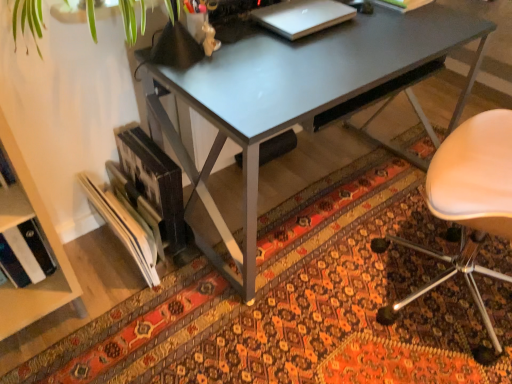
The image size is (512, 384). Describe the element at coordinates (402, 4) in the screenshot. I see `hardcover book at upper center` at that location.

Describe the element at coordinates (467, 208) in the screenshot. I see `beige leather chair at right` at that location.

Image resolution: width=512 pixels, height=384 pixels. Identify the location of sleek silver laptop at upper center. (302, 17).

The image size is (512, 384). What do you see at coordinates (301, 304) in the screenshot? I see `patterned carpet at lower center` at bounding box center [301, 304].

Where is `patterned carpet at lower center`? The width and height of the screenshot is (512, 384). patterned carpet at lower center is located at coordinates (301, 304).

Where is `metallic gray desk at center`? This screenshot has width=512, height=384. metallic gray desk at center is located at coordinates (295, 95).

Identify the location of laptop above the beige leather chair at right (from the image's perspective). The width and height of the screenshot is (512, 384). (302, 17).

From a real-world perspective, who is located lower, sleek silver laptop at upper center or beige leather chair at right?

beige leather chair at right, from a real-world perspective.

Is sleek silver laptop at upper center not within beige leather chair at right?

sleek silver laptop at upper center is positioned outside beige leather chair at right.

Considering the relative sizes of sleek silver laptop at upper center and beige leather chair at right in the image provided, is sleek silver laptop at upper center taller than beige leather chair at right?

No, sleek silver laptop at upper center is not taller than beige leather chair at right.

Choose the correct answer: Is patterned carpet at lower center inside beige leather chair at right or outside it?

patterned carpet at lower center cannot be found inside beige leather chair at right.

Which object is thinner, patterned carpet at lower center or beige leather chair at right?

Thinner between the two is beige leather chair at right.

Is patterned carpet at lower center closer to the viewer compared to beige leather chair at right?

Yes, patterned carpet at lower center is closer to the viewer.

Based on the photo, is hardcover book at upper center turned away from patterned carpet at lower center?

No.

From the image's perspective, is hardcover book at upper center positioned above or below patterned carpet at lower center?

From the image's perspective, hardcover book at upper center appears above patterned carpet at lower center.

Is hardcover book at upper center in front of patterned carpet at lower center?

No, hardcover book at upper center is further to the viewer.

Can you confirm if hardcover book at upper center is positioned to the left of patterned carpet at lower center?

Incorrect, hardcover book at upper center is not on the left side of patterned carpet at lower center.

Considering the points (274, 13) and (397, 7), which point is behind, point (274, 13) or point (397, 7)?

The point (397, 7) is farther from the camera.

Can you confirm if sleek silver laptop at upper center is wider than hardcover book at upper center?

No, sleek silver laptop at upper center is not wider than hardcover book at upper center.

This screenshot has height=384, width=512. What are the coordinates of `book that is on the right side of sleek silver laptop at upper center` in the screenshot? It's located at (402, 4).

Is sleek silver laptop at upper center positioned beyond the bounds of hardcover book at upper center?

sleek silver laptop at upper center lies outside hardcover book at upper center's area.

Locate an element on the screen. This screenshot has width=512, height=384. desk below the hardcover book at upper center (from the image's perspective) is located at coordinates (295, 95).

Is metallic gray desk at center not inside hardcover book at upper center?

Yes, metallic gray desk at center is located beyond the bounds of hardcover book at upper center.

Considering the relative sizes of metallic gray desk at center and hardcover book at upper center in the image provided, is metallic gray desk at center shorter than hardcover book at upper center?

No.

Based on the photo, which of these two, sleek silver laptop at upper center or metallic gray desk at center, is thinner?

With smaller width is sleek silver laptop at upper center.

In order to click on laptop above the metallic gray desk at center (from a real-world perspective) in this screenshot , I will do `click(302, 17)`.

Considering the points (266, 12) and (263, 101), which point is in front, point (266, 12) or point (263, 101)?

The point (263, 101) is closer.

Is there a large distance between sleek silver laptop at upper center and metallic gray desk at center?

sleek silver laptop at upper center is near metallic gray desk at center, not far away.

Is metallic gray desk at center positioned beyond the bounds of beige leather chair at right?

Yes, metallic gray desk at center is located beyond the bounds of beige leather chair at right.

Measure the distance between metallic gray desk at center and beige leather chair at right.

They are 21.61 inches apart.

Considering the relative sizes of metallic gray desk at center and beige leather chair at right in the image provided, is metallic gray desk at center smaller than beige leather chair at right?

No.

Consider the image. From a real-world perspective, is metallic gray desk at center located higher than beige leather chair at right?

No, from a real-world perspective, metallic gray desk at center is not over beige leather chair at right

This screenshot has height=384, width=512. What are the coordinates of `chair in front of the sleek silver laptop at upper center` in the screenshot? It's located at (467, 208).

Find the location of a particular element. This screenshot has height=384, width=512. mat below the beige leather chair at right (from the image's perspective) is located at coordinates (301, 304).

When comparing their distances from beige leather chair at right, does sleek silver laptop at upper center or metallic gray desk at center seem further?

Based on the image, sleek silver laptop at upper center appears to be further to beige leather chair at right.

Considering their positions, is metallic gray desk at center positioned closer to hardcover book at upper center than patterned carpet at lower center?

metallic gray desk at center lies closer to hardcover book at upper center than the other object.

Looking at the image, which one is located closer to beige leather chair at right, sleek silver laptop at upper center or patterned carpet at lower center?

patterned carpet at lower center is positioned closer to the anchor beige leather chair at right.

Based on the photo, when comparing their distances from patterned carpet at lower center, does sleek silver laptop at upper center or hardcover book at upper center seem further?

hardcover book at upper center lies further to patterned carpet at lower center than the other object.

Considering their positions, is beige leather chair at right positioned closer to metallic gray desk at center than sleek silver laptop at upper center?

Among the two, sleek silver laptop at upper center is located nearer to metallic gray desk at center.

Which object lies further to the anchor point patterned carpet at lower center, metallic gray desk at center or beige leather chair at right?

beige leather chair at right is positioned further to the anchor patterned carpet at lower center.

From the image, which object appears to be farther from patterned carpet at lower center, beige leather chair at right or sleek silver laptop at upper center?

The object further to patterned carpet at lower center is sleek silver laptop at upper center.

Estimate the real-world distances between objects in this image. Which object is further from metallic gray desk at center, sleek silver laptop at upper center or hardcover book at upper center?

hardcover book at upper center is further to metallic gray desk at center.

The width and height of the screenshot is (512, 384). I want to click on laptop between hardcover book at upper center and patterned carpet at lower center in the up-down direction, so click(x=302, y=17).

You are a GUI agent. You are given a task and a screenshot of the screen. Output one action in this format:
    pyautogui.click(x=<x>, y=<y>)
    Task: Click on the desk between sleek silver laptop at upper center and patterned carpet at lower center from top to bottom
    
    Given the screenshot: What is the action you would take?
    pyautogui.click(x=295, y=95)

Locate an element on the screen. The image size is (512, 384). desk between hardcover book at upper center and patterned carpet at lower center from top to bottom is located at coordinates (295, 95).

This screenshot has height=384, width=512. Find the location of `laptop positioned between metallic gray desk at center and hardcover book at upper center from near to far`. laptop positioned between metallic gray desk at center and hardcover book at upper center from near to far is located at coordinates (302, 17).